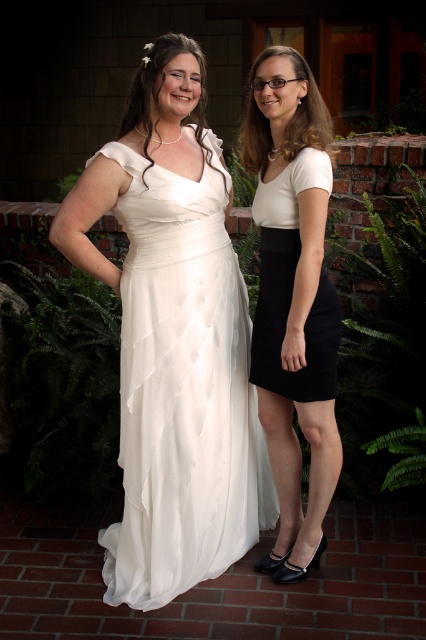
Question: Can you confirm if white satin dress at center is positioned to the left of black matte skirt at right?

Choices:
 (A) yes
 (B) no

Answer: (A)

Question: Which object is closer to the camera taking this photo?

Choices:
 (A) white satin dress at center
 (B) matte white blouse at center

Answer: (B)

Question: Can you confirm if white satin dress at center is bigger than black matte skirt at right?

Choices:
 (A) no
 (B) yes

Answer: (B)

Question: Which of the following is the closest to the observer?

Choices:
 (A) white satin dress at center
 (B) black matte skirt at right
 (C) matte white blouse at center

Answer: (B)

Question: Which point appears closest to the camera in this image?

Choices:
 (A) (164, 40)
 (B) (278, 349)
 (C) (324, 144)

Answer: (A)

Question: Is white satin dress at center below black matte skirt at right?

Choices:
 (A) yes
 (B) no

Answer: (A)